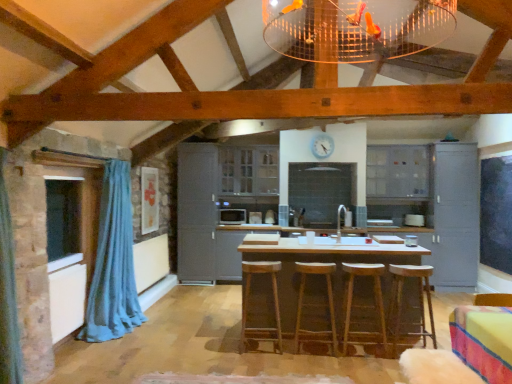
Question: Can you confirm if wooden bar stool at center, marked as the 1th bar stool in a right-to-left arrangement, is positioned to the left of brown wooden bar stool at center, placed as the 1th bar stool when sorted from left to right?

Choices:
 (A) no
 (B) yes

Answer: (A)

Question: Is wooden bar stool at center, marked as the 1th bar stool in a right-to-left arrangement, not inside brown wooden bar stool at center, arranged as the 4th bar stool when viewed from the right?

Choices:
 (A) no
 (B) yes

Answer: (B)

Question: Does wooden bar stool at center, marked as the 1th bar stool in a right-to-left arrangement, have a lesser width compared to brown wooden bar stool at center, arranged as the 4th bar stool when viewed from the right?

Choices:
 (A) no
 (B) yes

Answer: (A)

Question: Is the position of wooden bar stool at center, placed as the fourth bar stool when sorted from left to right, less distant than that of brown wooden bar stool at center, placed as the 1th bar stool when sorted from left to right?

Choices:
 (A) no
 (B) yes

Answer: (B)

Question: From a real-world perspective, is wooden bar stool at center, marked as the 1th bar stool in a right-to-left arrangement, on top of brown wooden bar stool at center, arranged as the 4th bar stool when viewed from the right?

Choices:
 (A) yes
 (B) no

Answer: (B)

Question: Considering the positions of satin black microwave at center and transparent glass window at left in the image, is satin black microwave at center bigger or smaller than transparent glass window at left?

Choices:
 (A) small
 (B) big

Answer: (A)

Question: Looking at their shapes, would you say satin black microwave at center is wider or thinner than transparent glass window at left?

Choices:
 (A) thin
 (B) wide

Answer: (B)

Question: From the image's perspective, is satin black microwave at center positioned above or below transparent glass window at left?

Choices:
 (A) above
 (B) below

Answer: (B)

Question: Is point (236, 210) positioned closer to the camera than point (51, 215)?

Choices:
 (A) farther
 (B) closer

Answer: (A)

Question: Relative to wooden table at center, is blue fabric curtain at left in front or behind?

Choices:
 (A) behind
 (B) front

Answer: (A)

Question: Looking at their shapes, would you say blue fabric curtain at left is wider or thinner than wooden table at center?

Choices:
 (A) wide
 (B) thin

Answer: (B)

Question: Is blue fabric curtain at left spatially inside wooden table at center, or outside of it?

Choices:
 (A) inside
 (B) outside

Answer: (B)

Question: From a real-world perspective, is blue fabric curtain at left above or below wooden table at center?

Choices:
 (A) above
 (B) below

Answer: (A)

Question: From a real-world perspective, is wooden bar stool at center above or below wooden bar stool at center, placed as the fourth bar stool when sorted from left to right?

Choices:
 (A) below
 (B) above

Answer: (B)

Question: Which is correct: wooden bar stool at center is inside wooden bar stool at center, placed as the fourth bar stool when sorted from left to right, or outside of it?

Choices:
 (A) outside
 (B) inside

Answer: (A)